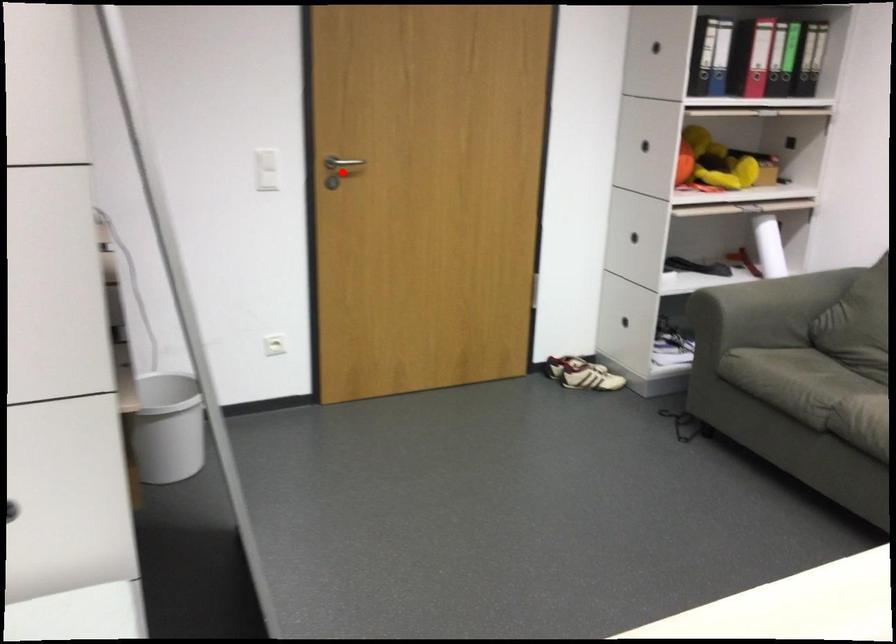
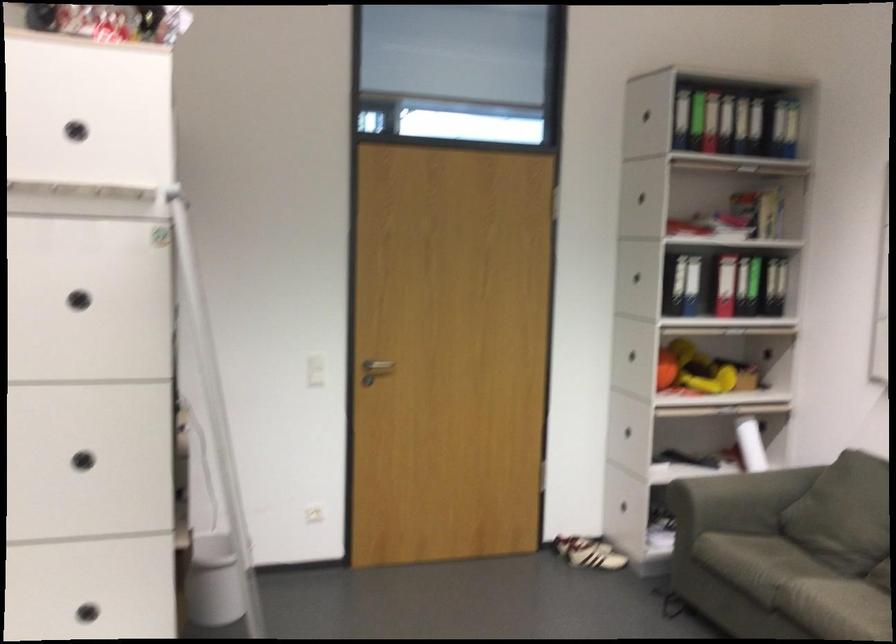
Question: A red point is marked in image1. In image2, is the corresponding 3D point closer to the camera or farther? Reply with the corresponding letter.

Choices:
 (A) The corresponding 3D point is closer.
 (B) The corresponding 3D point is farther.

Answer: (B)